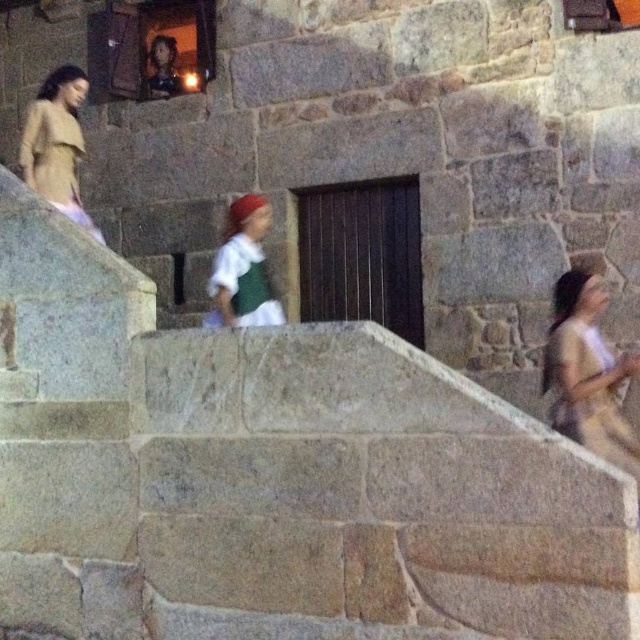
Can you confirm if matte beige dress at right is taller than green fabric dress at center?

Correct, matte beige dress at right is much taller as green fabric dress at center.

Describe the element at coordinates (588, 372) in the screenshot. I see `matte beige dress at right` at that location.

Locate an element on the screen. matte beige dress at right is located at coordinates pos(588,372).

Between point (588, 412) and point (64, 150), which one is positioned in front?

Point (588, 412)

Does point (596, 300) lie behind point (77, 134)?

No.

The width and height of the screenshot is (640, 640). What are the coordinates of `matte beige dress at right` in the screenshot? It's located at (588, 372).

Does gray stone stairs at center appear on the left side of green fabric dress at center?

In fact, gray stone stairs at center is to the right of green fabric dress at center.

Between point (93, 410) and point (275, 296), which one is positioned behind?

The point (275, 296) is more distant.

The width and height of the screenshot is (640, 640). Find the location of `gray stone stairs at center`. gray stone stairs at center is located at coordinates (276, 476).